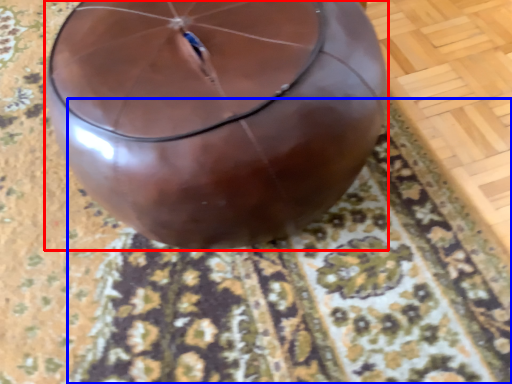
Question: Which point is closer to the camera, balloon (highlighted by a red box) or mat (highlighted by a blue box)?

Choices:
 (A) balloon
 (B) mat

Answer: (A)